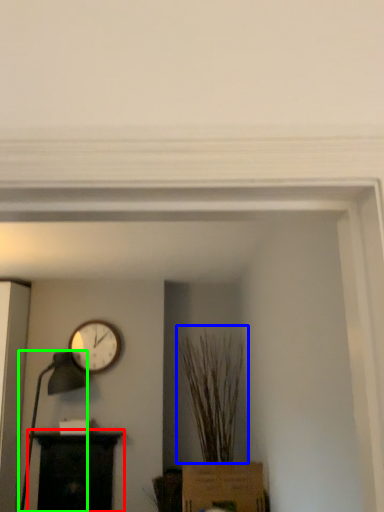
Question: Based on their relative distances, which object is farther from furniture (highlighted by a red box)? Choose from plant (highlighted by a blue box) and table lamp (highlighted by a green box).

Choices:
 (A) plant
 (B) table lamp

Answer: (A)